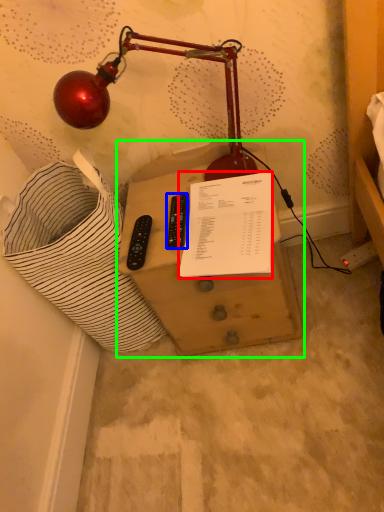
Question: Which is farther away from document (highlighted by a red box)? control (highlighted by a blue box) or furniture (highlighted by a green box)?

Choices:
 (A) control
 (B) furniture

Answer: (B)